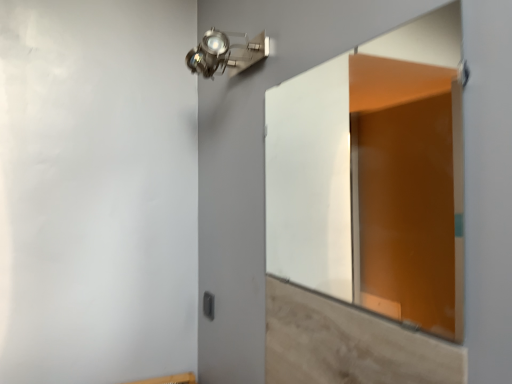
Question: Considering their positions, is black plastic switch at lower center located in front of or behind metallic spot light at upper center?

Choices:
 (A) front
 (B) behind

Answer: (B)

Question: Looking at their shapes, would you say black plastic switch at lower center is wider or thinner than metallic spot light at upper center?

Choices:
 (A) wide
 (B) thin

Answer: (B)

Question: Which object is the farthest from the black plastic switch at lower center?

Choices:
 (A) metallic spot light at upper center
 (B) light brown wood at lower right
 (C) transparent glass door at center

Answer: (C)

Question: Which is farther from the black plastic switch at lower center?

Choices:
 (A) transparent glass door at center
 (B) light brown wood at lower right
 (C) metallic spot light at upper center

Answer: (A)